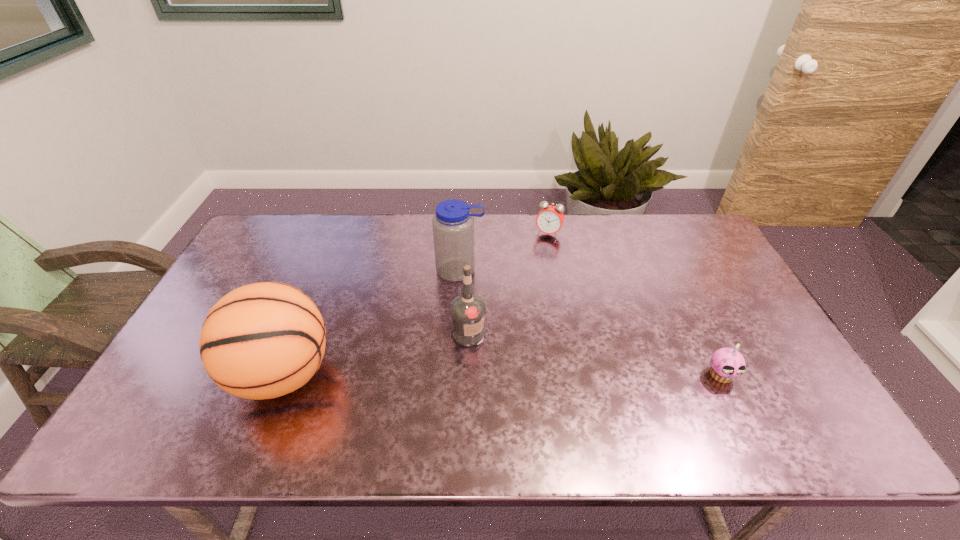
This screenshot has width=960, height=540. Find the location of `unoccupied area between the water bottle and the fourth object from left to right`. unoccupied area between the water bottle and the fourth object from left to right is located at coordinates (504, 252).

This screenshot has height=540, width=960. Identify the location of free space between the basketball and the fourth object from left to right. (416, 304).

I want to click on free space between the leftmost object and the vodka, so click(x=376, y=354).

Image resolution: width=960 pixels, height=540 pixels. Find the location of `free point between the vodka and the farthest object`. free point between the vodka and the farthest object is located at coordinates (509, 284).

What are the coordinates of `free point between the basketball and the fourth nearest object` in the screenshot? It's located at (372, 322).

Where is `vacant space in between the leftmost object and the rightmost object`? vacant space in between the leftmost object and the rightmost object is located at coordinates (502, 375).

The width and height of the screenshot is (960, 540). Find the location of `vacant area that lies between the rightmost object and the farthest object`. vacant area that lies between the rightmost object and the farthest object is located at coordinates (635, 305).

Find the location of `object that ranks as the closest to the cupcake`. object that ranks as the closest to the cupcake is located at coordinates (468, 310).

Identify the location of object that is the closest to the water bottle. Image resolution: width=960 pixels, height=540 pixels. (468, 310).

This screenshot has width=960, height=540. What are the coordinates of `vacant point that satisfies the following two spatial constraints: 1. on the back side of the water bottle; 2. on the right side of the basketball` in the screenshot? It's located at (324, 271).